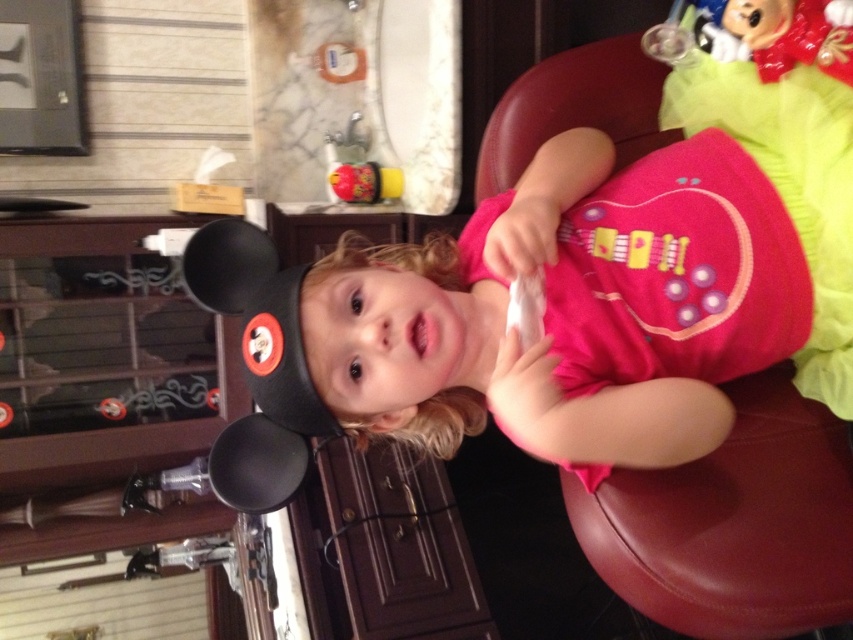
Does blonde curly hair at center appear over shiny plastic toy at center?

Actually, blonde curly hair at center is below shiny plastic toy at center.

Does point (428, 422) come behind point (367, 172)?

No, (428, 422) is in front of (367, 172).

Where is `blonde curly hair at center`? The width and height of the screenshot is (853, 640). blonde curly hair at center is located at coordinates (433, 422).

In the scene shown: Between leather at right and shiny plastic toy at center, which one has less height?

shiny plastic toy at center is shorter.

Between leather at right and shiny plastic toy at center, which one appears on the left side from the viewer's perspective?

shiny plastic toy at center

Does point (831, 497) come in front of point (372, 189)?

Yes, it is in front of point (372, 189).

The image size is (853, 640). What are the coordinates of `leather at right` in the screenshot? It's located at (733, 524).

Who is positioned more to the right, leather at right or blonde curly hair at center?

From the viewer's perspective, leather at right appears more on the right side.

Is leather at right further to the viewer compared to blonde curly hair at center?

No, it is not.

Which is in front, point (572, 474) or point (349, 236)?

Point (572, 474)

Find the location of a particular element. This screenshot has width=853, height=640. leather at right is located at coordinates (733, 524).